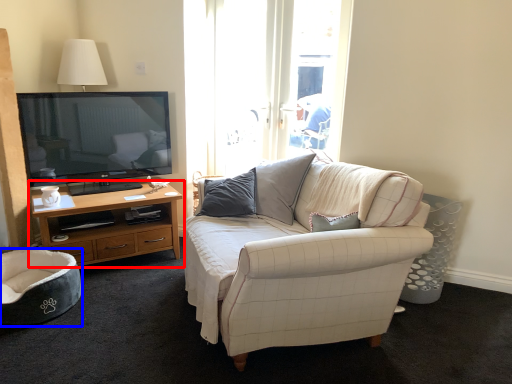
Question: Among these objects, which one is nearest to the camera, cabinetry (highlighted by a red box) or chair (highlighted by a blue box)?

Choices:
 (A) cabinetry
 (B) chair

Answer: (B)